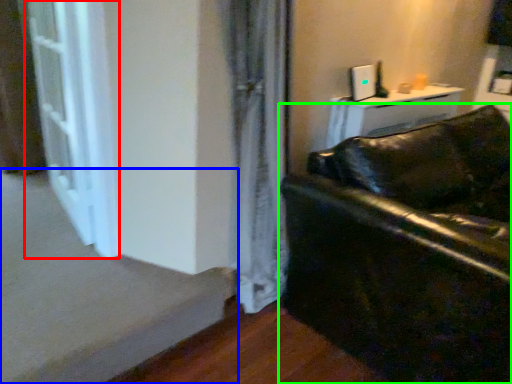
Question: Based on their relative distances, which object is farther from screen door (highlighted by a red box)? Choose from stairwell (highlighted by a blue box) and studio couch (highlighted by a green box).

Choices:
 (A) stairwell
 (B) studio couch

Answer: (B)